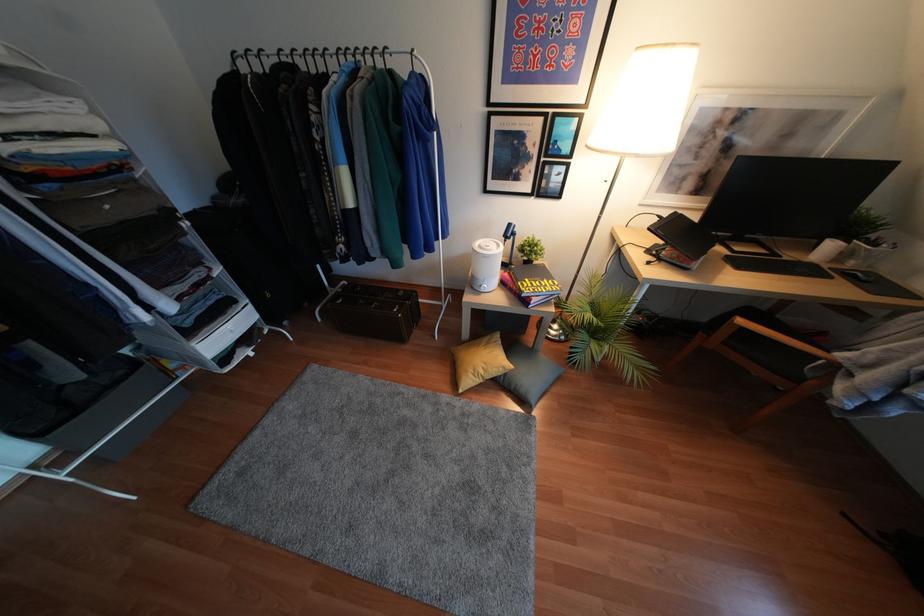
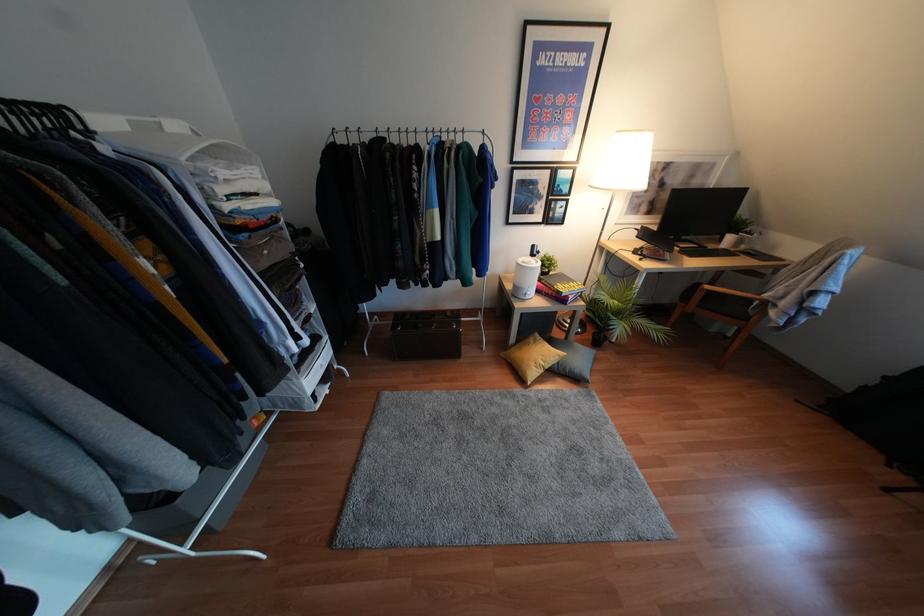
Where in the second image is the point corresponding to [481,290] from the first image?

(526, 297)